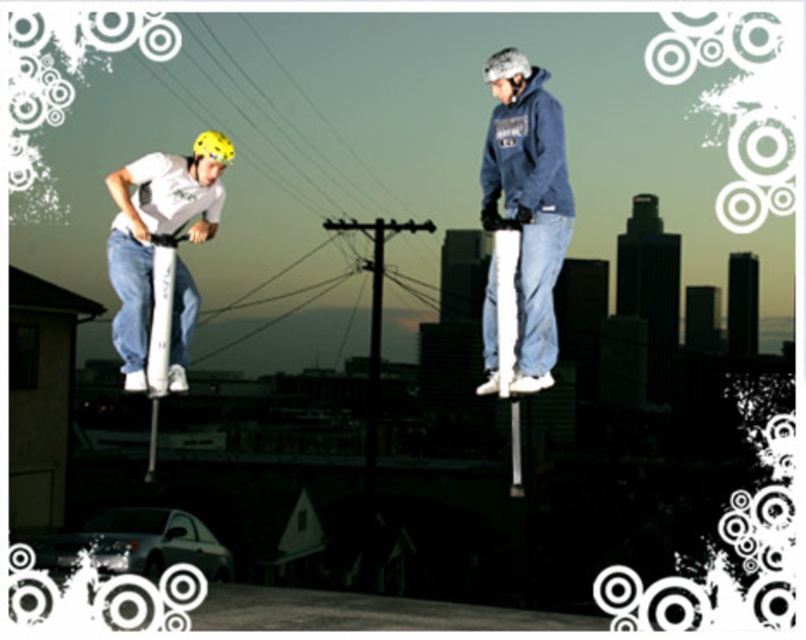
You are standing at the point labeled as point [505,60]. If you want to throw a ball to someone who is exactly 100 meters away from you, can you reach them?

The distance between you and the viewer is 75.31 meters, so you cannot reach someone who is exactly 100 meters away from you.

You are a photographer trying to capture a photo of the two people jumping on pogo sticks. You notice the white matte pogo stick at left and the yellow matte helmet at left in your frame. Based on their positions, which object is positioned further to the left in the image?

The white matte pogo stick at left is positioned to the left of the yellow matte helmet at left, so it is further to the left in the image.

You are planning to throw a frisbee from the white matte pogo stick at left to the silver metallic helmet at upper right. Given that the recommended throwing distance for this frisbee is up to 70 feet, will you be able to successfully throw it from the pogo stick to the helmet?

The white matte pogo stick at left is 72.41 feet from the silver metallic helmet at upper right. Since the recommended throwing distance is up to 70 feet, the frisbee may not reach the silver metallic helmet at upper right as the distance exceeds the recommended limit.